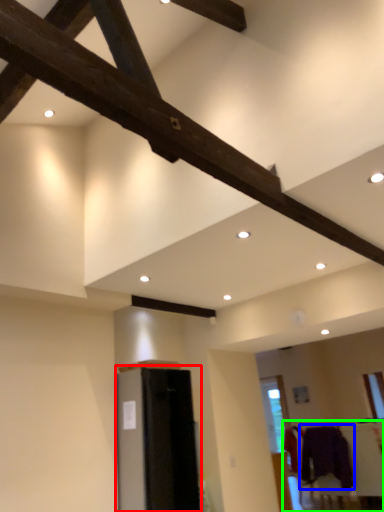
Question: Based on their relative distances, which object is farther from furniture (highlighted by a red box)? Choose from clothing (highlighted by a blue box) and furniture (highlighted by a green box).

Choices:
 (A) clothing
 (B) furniture

Answer: (A)